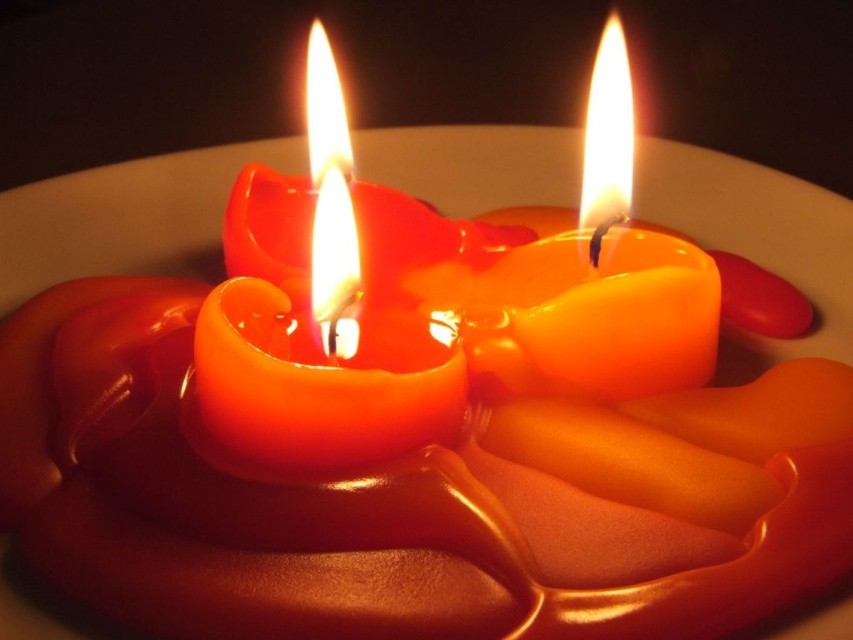
You are setting up a table for a romantic dinner and want to place a flower vase between the glossy wax candle at center and the orange glossy candle at center. According to the scene description, which candle should the vase be placed above to ensure it is centered properly?

The vase should be placed above the glossy wax candle at center because it is positioned below the orange glossy candle at center, so placing the vase above the lower one will center it between both candles.

In the scene shown: You are planning to place a new candle between the glossy wax candle at center and the orange glossy candle at center. The new candle is 10 centimeters wide. Will there be enough space between them to fit the new candle?

The distance between the glossy wax candle at center and the orange glossy candle at center is 19.79 centimeters. Since the new candle is 10 centimeters wide, there is enough space to fit it between them.

You are standing in front of the candle holder and want to place a new candle. The candle must be placed at a position that is closer to the front of the candle holder than the existing candles. Which of the two existing candle positions, point A at point (350, 381) or point B at point (554, 275), should you use as a reference to ensure the new candle is placed in front?

You should use point A at point (350, 381) as a reference because it is in front of point B at point (554, 275), so placing the new candle closer to point A would ensure it is positioned further forward on the candle holder.